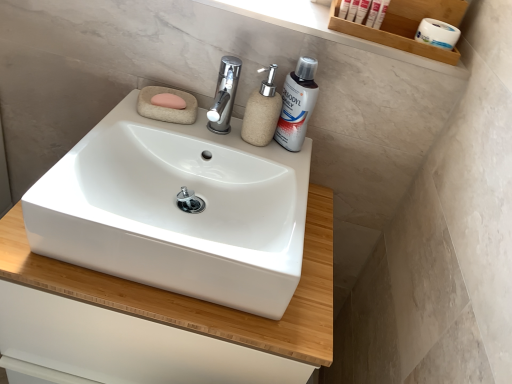
Question: Does wooden shelf at upper right have a lesser width compared to white plastic toothpaste at upper right, marked as the 2th personal care in a left-to-right arrangement?

Choices:
 (A) yes
 (B) no

Answer: (B)

Question: Does wooden shelf at upper right have a greater width compared to white plastic toothpaste at upper right, the first personal care from the right?

Choices:
 (A) yes
 (B) no

Answer: (A)

Question: Does wooden shelf at upper right have a larger size compared to white plastic toothpaste at upper right, marked as the 2th personal care in a left-to-right arrangement?

Choices:
 (A) yes
 (B) no

Answer: (A)

Question: Could you tell me if wooden shelf at upper right is turned towards white plastic toothpaste at upper right, marked as the 2th personal care in a left-to-right arrangement?

Choices:
 (A) no
 (B) yes

Answer: (B)

Question: Can you confirm if wooden shelf at upper right is shorter than white plastic toothpaste at upper right, the first personal care from the right?

Choices:
 (A) yes
 (B) no

Answer: (B)

Question: In the image, is beige textured soap dispenser at center positioned in front of or behind white matte tube at upper right?

Choices:
 (A) front
 (B) behind

Answer: (A)

Question: From the image's perspective, relative to white matte tube at upper right, is beige textured soap dispenser at center above or below?

Choices:
 (A) above
 (B) below

Answer: (B)

Question: Visually, is beige textured soap dispenser at center positioned to the left or to the right of white matte tube at upper right?

Choices:
 (A) left
 (B) right

Answer: (A)

Question: Do you think beige textured soap dispenser at center is within white matte tube at upper right, or outside of it?

Choices:
 (A) outside
 (B) inside

Answer: (A)

Question: Is chrome metallic tap at center bigger or smaller than white ceramic sink at center?

Choices:
 (A) small
 (B) big

Answer: (A)

Question: From the image's perspective, relative to white ceramic sink at center, is chrome metallic tap at center above or below?

Choices:
 (A) above
 (B) below

Answer: (A)

Question: Is chrome metallic tap at center taller or shorter than white ceramic sink at center?

Choices:
 (A) short
 (B) tall

Answer: (A)

Question: Is chrome metallic tap at center in front of or behind white ceramic sink at center in the image?

Choices:
 (A) behind
 (B) front

Answer: (A)

Question: From the image's perspective, is white matte tube at upper right located above or below white plastic toothpaste at upper right, marked as the 2th personal care in a left-to-right arrangement?

Choices:
 (A) below
 (B) above

Answer: (A)

Question: Is point (380, 16) positioned closer to the camera than point (369, 11)?

Choices:
 (A) closer
 (B) farther

Answer: (A)